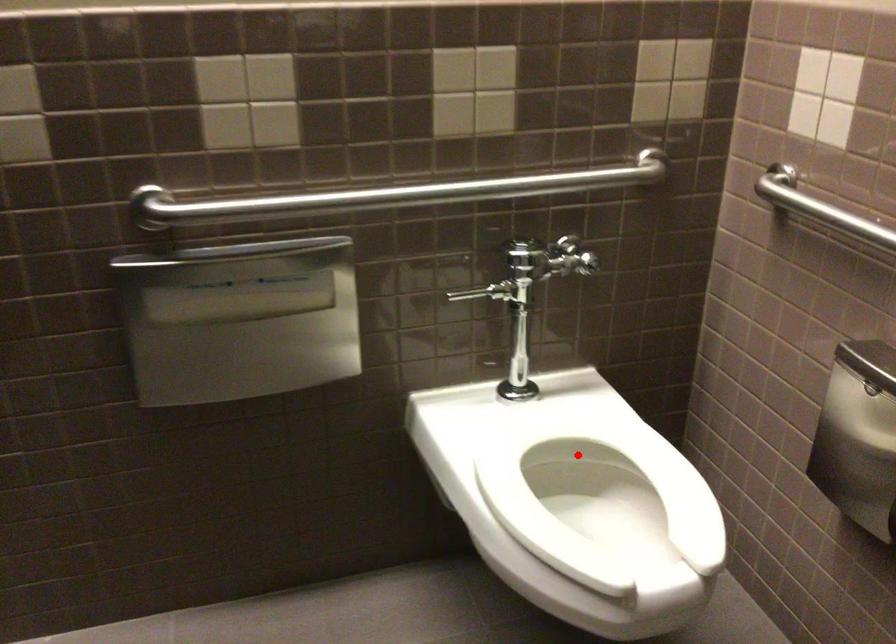
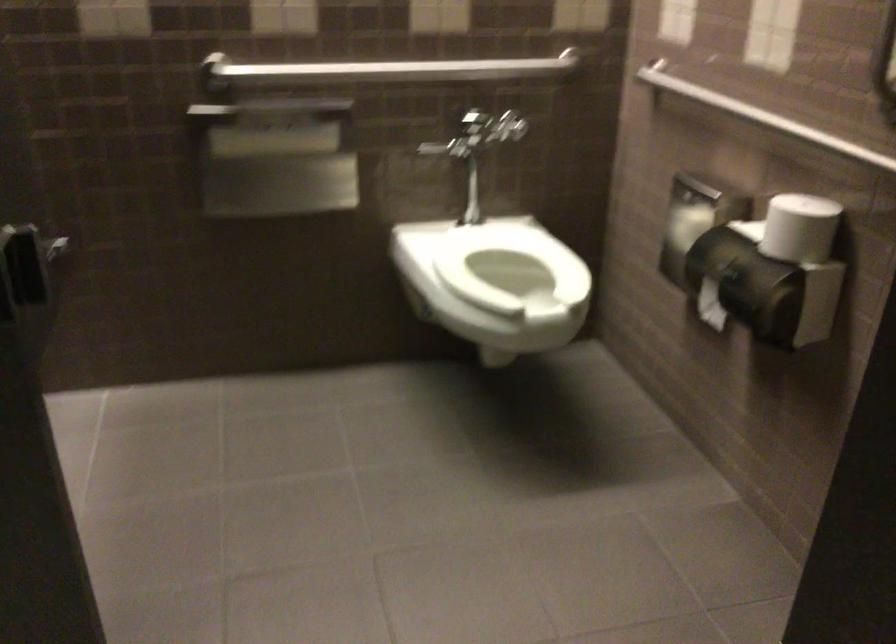
Question: I am providing you with two images of the same scene from different viewpoints. In image1, a red point is highlighted. Considering the same 3D point in image2, which of the following is correct?

Choices:
 (A) It is closer
 (B) It is farther

Answer: (B)